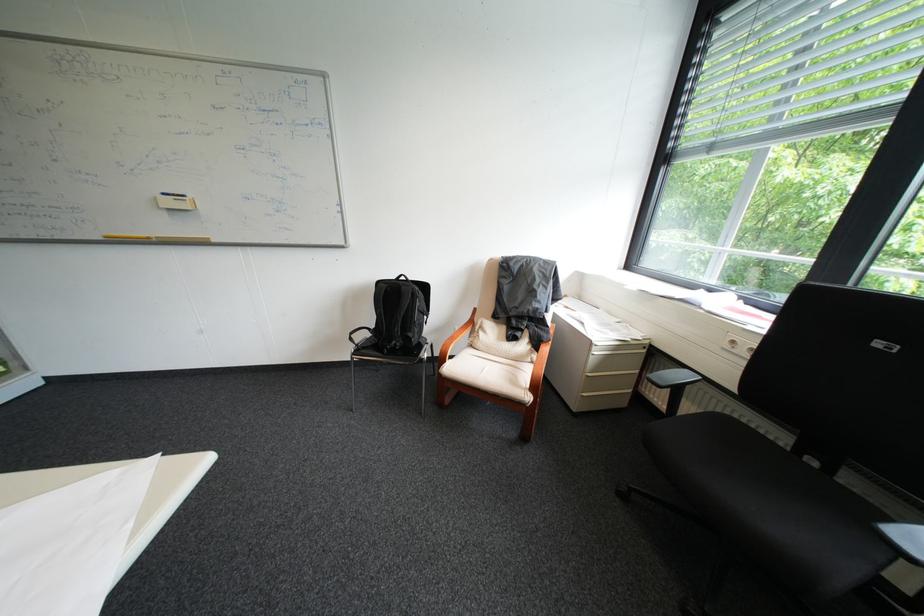
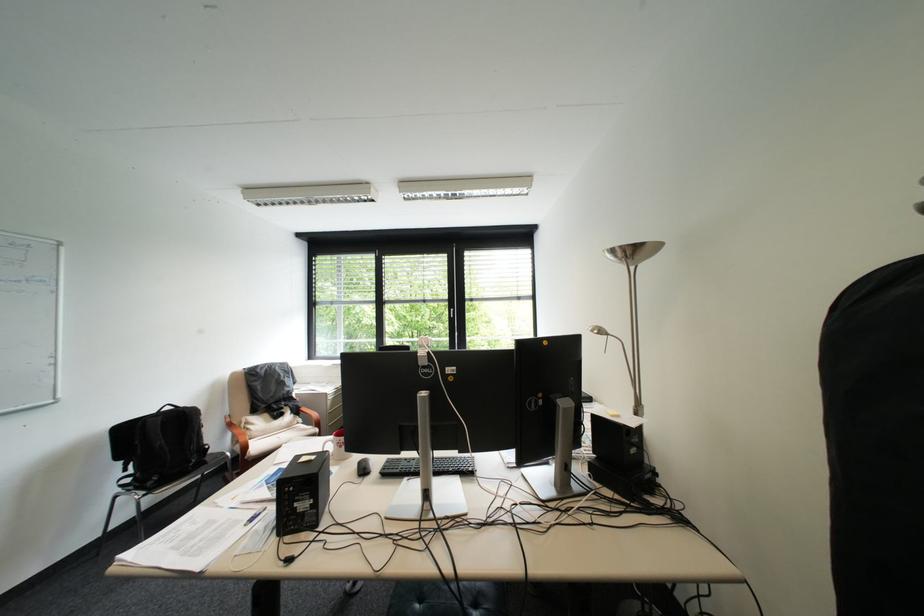
Find the pixel in the second image that matches (415,288) in the first image.

(198, 411)